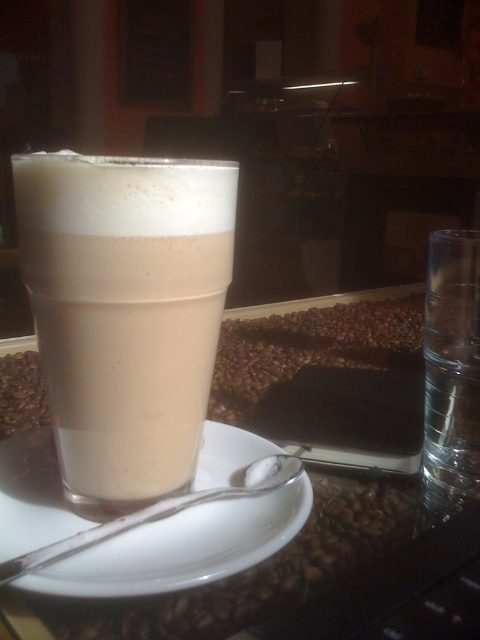
Is smooth beige foam at center positioned before silver metallic spoon at lower center?

That is False.

This screenshot has height=640, width=480. In order to click on smooth beige foam at center in this screenshot , I will do (126, 310).

Where is `smooth beige foam at center`? The height and width of the screenshot is (640, 480). smooth beige foam at center is located at coordinates pos(126,310).

This screenshot has width=480, height=640. Find the location of `smooth beige foam at center`. smooth beige foam at center is located at coordinates (126, 310).

Image resolution: width=480 pixels, height=640 pixels. Describe the element at coordinates (311, 348) in the screenshot. I see `dark chocolate bar at center` at that location.

What do you see at coordinates (311, 348) in the screenshot?
I see `dark chocolate bar at center` at bounding box center [311, 348].

I want to click on dark chocolate bar at center, so click(x=311, y=348).

Does smooth beige foam at center have a lesser height compared to dark chocolate bar at center?

Incorrect, smooth beige foam at center's height does not fall short of dark chocolate bar at center's.

Describe the element at coordinates (126, 310) in the screenshot. I see `smooth beige foam at center` at that location.

Locate an element on the screen. smooth beige foam at center is located at coordinates (126, 310).